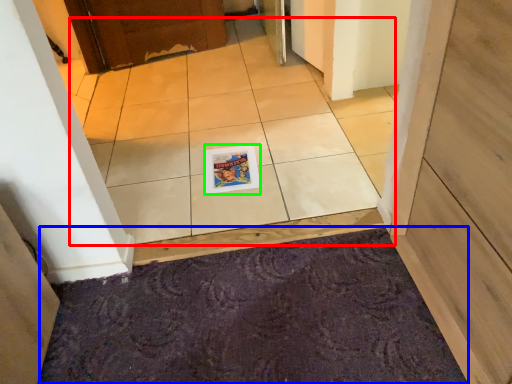
Question: Which is nearer to the ceramic tile (highlighted by a red box)? doormat (highlighted by a blue box) or magazine (highlighted by a green box).

Choices:
 (A) doormat
 (B) magazine

Answer: (B)